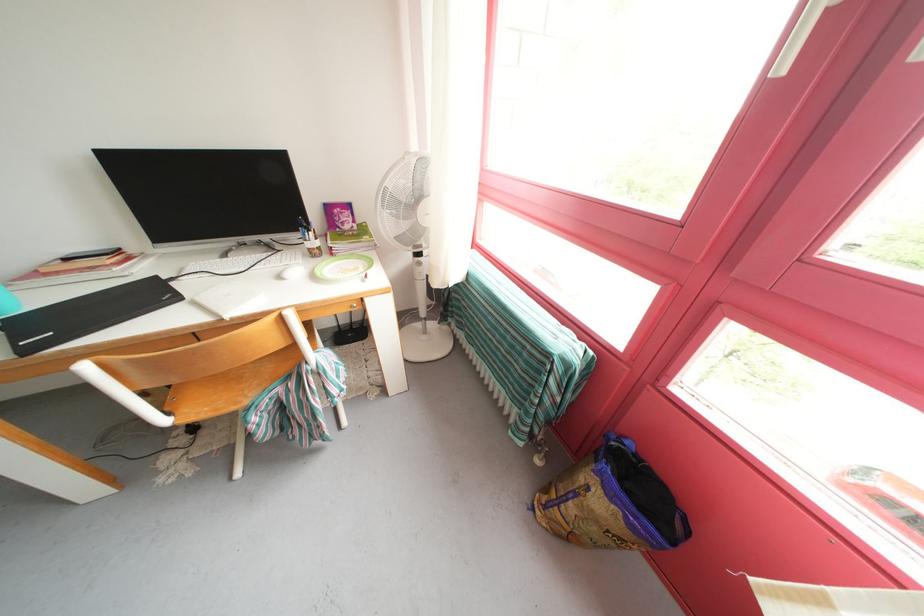
The height and width of the screenshot is (616, 924). Describe the element at coordinates (419, 267) in the screenshot. I see `a fan button` at that location.